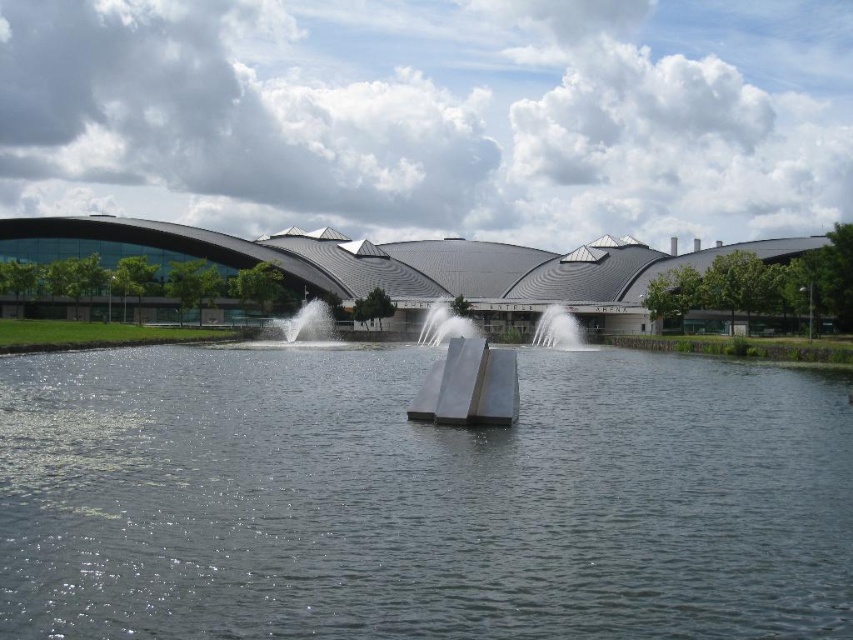
Looking at this image, can you confirm if clear water at center is positioned to the left of silver metallic fountain at center?

Indeed, clear water at center is positioned on the left side of silver metallic fountain at center.

At what (x,y) coordinates should I click in order to perform the action: click on clear water at center. Please return your answer as a coordinate pair (x, y). The height and width of the screenshot is (640, 853). Looking at the image, I should click on (419, 499).

Is point (213, 444) farther from camera compared to point (569, 348)?

No, it is not.

Identify the location of clear water at center. This screenshot has width=853, height=640. (419, 499).